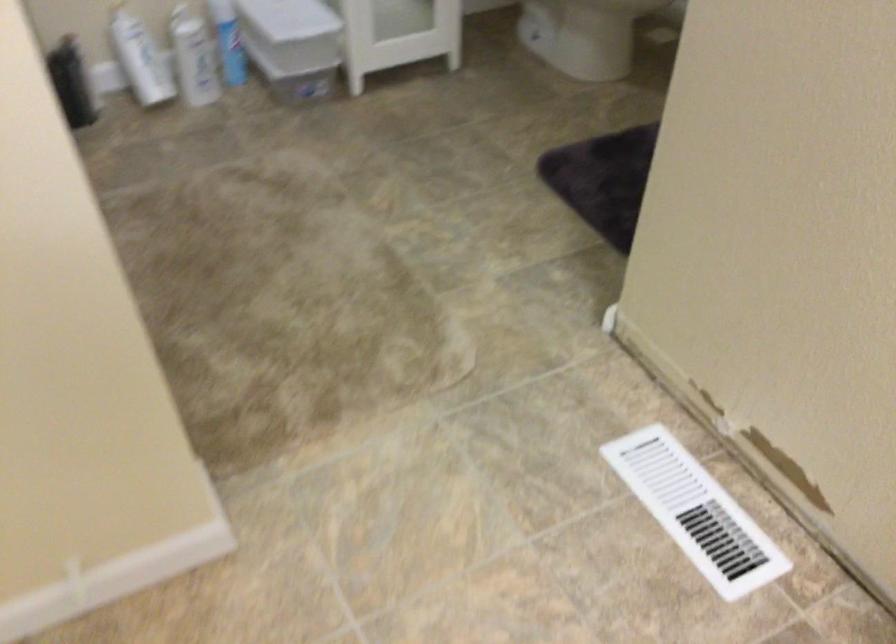
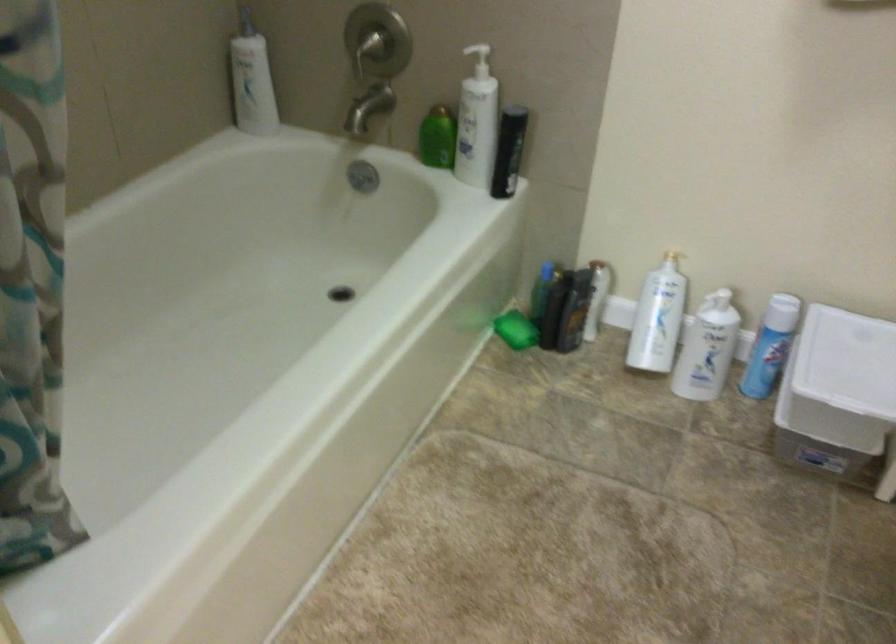
The point at (72,84) is marked in the first image. Where is the corresponding point in the second image?

(554, 308)